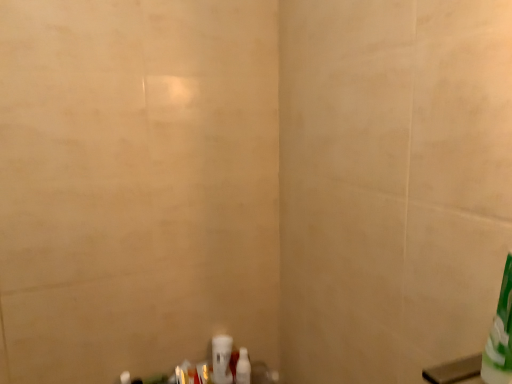
What do you see at coordinates (222, 359) in the screenshot? I see `white plastic container at lower center` at bounding box center [222, 359].

Where is `white plastic container at lower center`? white plastic container at lower center is located at coordinates (222, 359).

The width and height of the screenshot is (512, 384). Identify the location of white plastic container at lower center. (222, 359).